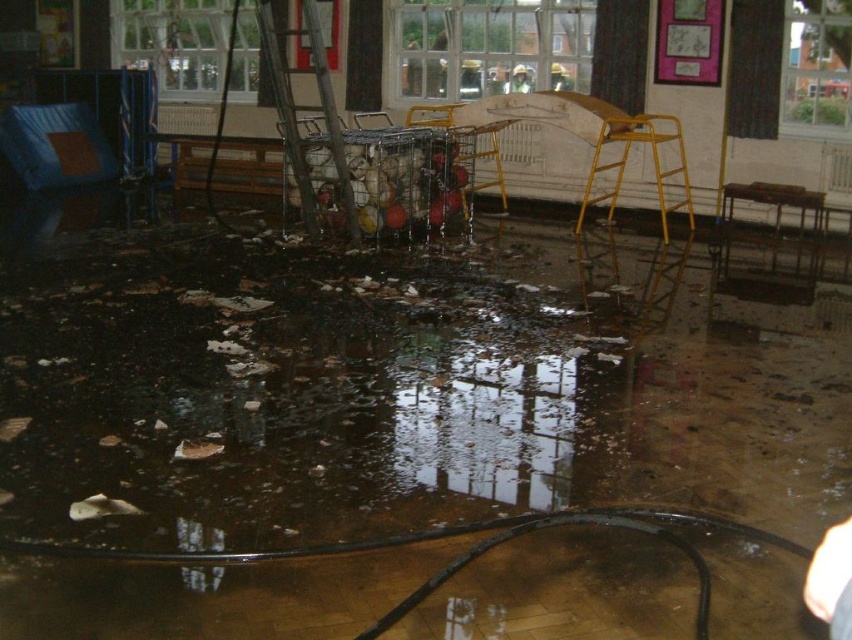
Measure the distance from white fabric at lower right to matte yellow stool at center.

white fabric at lower right is 7.09 meters from matte yellow stool at center.

Is point (824, 586) farther from viewer compared to point (559, 81)?

No, (824, 586) is in front of (559, 81).

Measure the distance between point (841, 525) and camera.

Point (841, 525) is 2.42 meters away from camera.

The width and height of the screenshot is (852, 640). In order to click on white fabric at lower right in this screenshot , I will do pos(832,580).

Which is in front, point (30, 193) or point (329, 104)?

Point (329, 104) is more forward.

Can you confirm if blue fabric chair at left is positioned above metallic silver ladder at center?

Yes, blue fabric chair at left is above metallic silver ladder at center.

Between point (62, 104) and point (312, 10), which one is positioned behind?

Point (62, 104)

The height and width of the screenshot is (640, 852). I want to click on blue fabric chair at left, so click(x=55, y=147).

Does white fabric at lower right have a larger size compared to light brown leather helmet at upper center?

Correct, white fabric at lower right is larger in size than light brown leather helmet at upper center.

Between white fabric at lower right and light brown leather helmet at upper center, which one has more height?

light brown leather helmet at upper center

Who is more forward, (x=845, y=588) or (x=521, y=80)?

Point (x=845, y=588)

Where is `white fabric at lower right`? The height and width of the screenshot is (640, 852). white fabric at lower right is located at coordinates (832, 580).